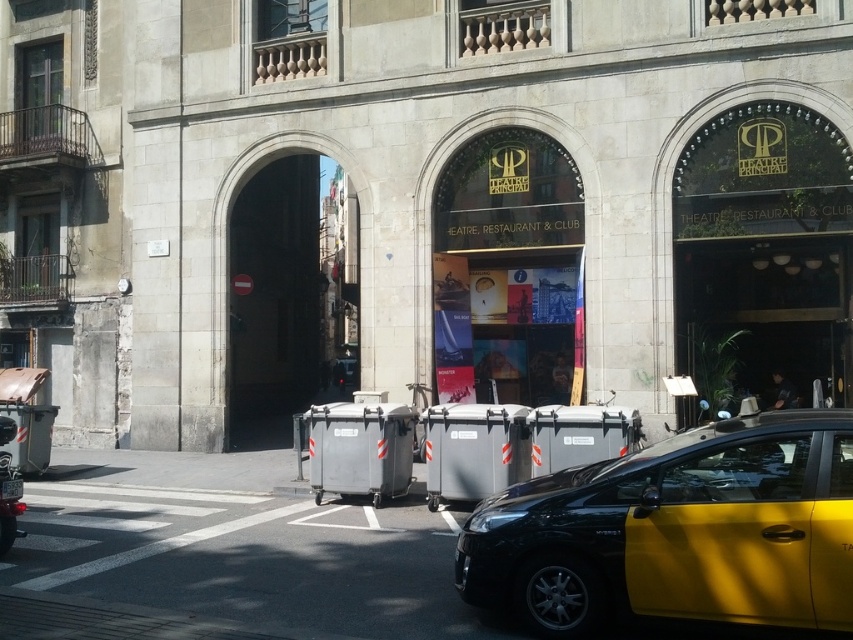
Question: Does yellow matte taxi at lower right have a lesser width compared to white plastic license plate at lower center?

Choices:
 (A) no
 (B) yes

Answer: (A)

Question: Estimate the real-world distances between objects in this image. Which object is farther from the white plastic license plate at lower center?

Choices:
 (A) shiny chrome motorcycle at lower left
 (B) yellow matte taxi at lower right

Answer: (B)

Question: Does yellow matte taxi at lower right appear on the left side of white plastic license plate at lower center?

Choices:
 (A) no
 (B) yes

Answer: (A)

Question: Can you confirm if yellow matte taxi at lower right is positioned above shiny chrome motorcycle at lower left?

Choices:
 (A) no
 (B) yes

Answer: (B)

Question: Which point is closer to the camera?

Choices:
 (A) (3, 417)
 (B) (535, 593)

Answer: (B)

Question: Based on their relative distances, which object is farther from the white plastic license plate at lower center?

Choices:
 (A) shiny chrome motorcycle at lower left
 (B) yellow matte taxi at lower right

Answer: (B)